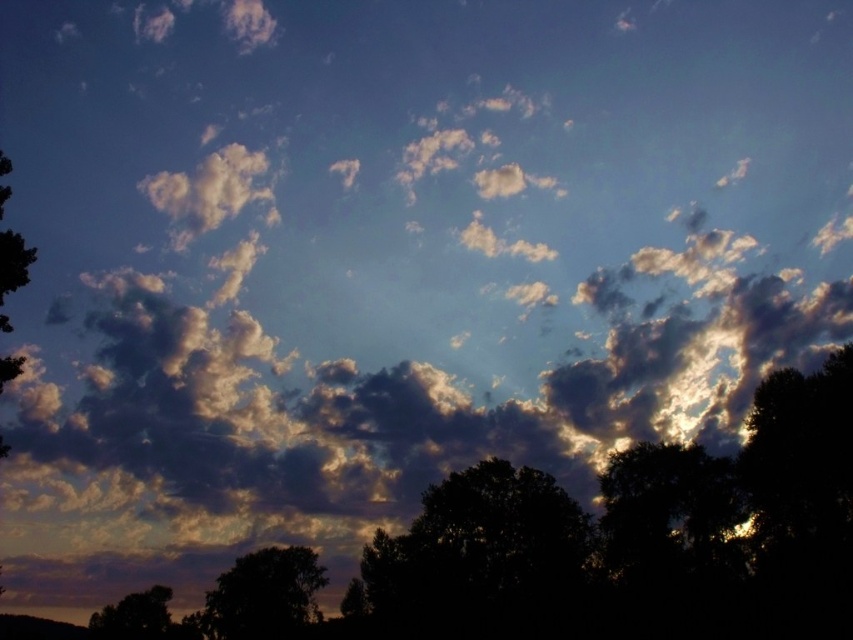
You are an observer looking at the sky scene. You notice two silhouette trees in the foreground. Which silhouette tree is closer to you, the dark silhouette tree at center or the silhouette tree at lower left?

The dark silhouette tree at center is closer to you because it is in front of the silhouette tree at lower left.

You are an astronomer analyzing the position of celestial objects in this sky scene. You notice a point at coordinates (x=479, y=560). Based on the scene description, what object does this point most likely represent?

The point at coordinates (x=479, y=560) corresponds to the dark silhouette tree at center.

You are an observer looking at the sky scene. You see the dark silhouette tree at center and the silhouette tree at lower left. Which tree is positioned more to the east if the sun is setting in the west?

The dark silhouette tree at center is positioned more to the east because it is to the right of the silhouette tree at lower left, and since the sun is setting in the west, right would correspond to east.